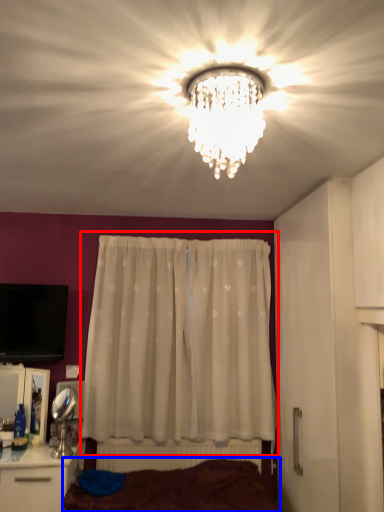
Question: Among these objects, which one is nearest to the camera, curtain (highlighted by a red box) or bed frame (highlighted by a blue box)?

Choices:
 (A) curtain
 (B) bed frame

Answer: (B)